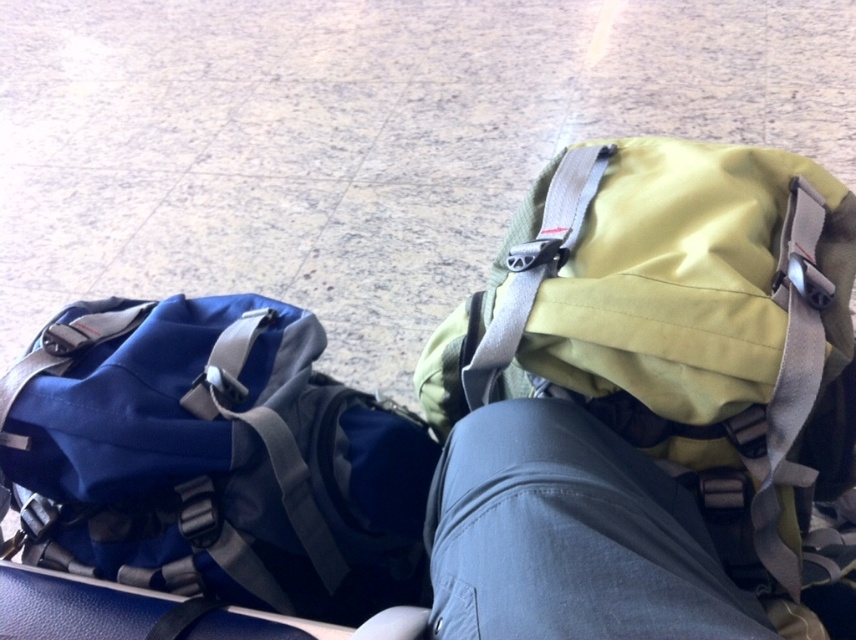
Question: Can you confirm if matte green backpack at upper right is positioned above matte blue backpack at left?

Choices:
 (A) yes
 (B) no

Answer: (A)

Question: Which point is closer to the camera taking this photo?

Choices:
 (A) (447, 406)
 (B) (510, 330)
 (C) (287, 609)

Answer: (B)

Question: Estimate the real-world distances between objects in this image. Which object is farther from the matte green backpack at upper right?

Choices:
 (A) gray fabric strap at upper center
 (B) matte blue backpack at left

Answer: (B)

Question: Considering the real-world distances, which object is farthest from the matte blue backpack at left?

Choices:
 (A) gray fabric strap at upper center
 (B) matte green backpack at upper right

Answer: (B)

Question: Considering the relative positions of matte green backpack at upper right and matte blue backpack at left in the image provided, where is matte green backpack at upper right located with respect to matte blue backpack at left?

Choices:
 (A) above
 (B) below

Answer: (A)

Question: Does matte green backpack at upper right appear over gray fabric strap at upper center?

Choices:
 (A) no
 (B) yes

Answer: (A)